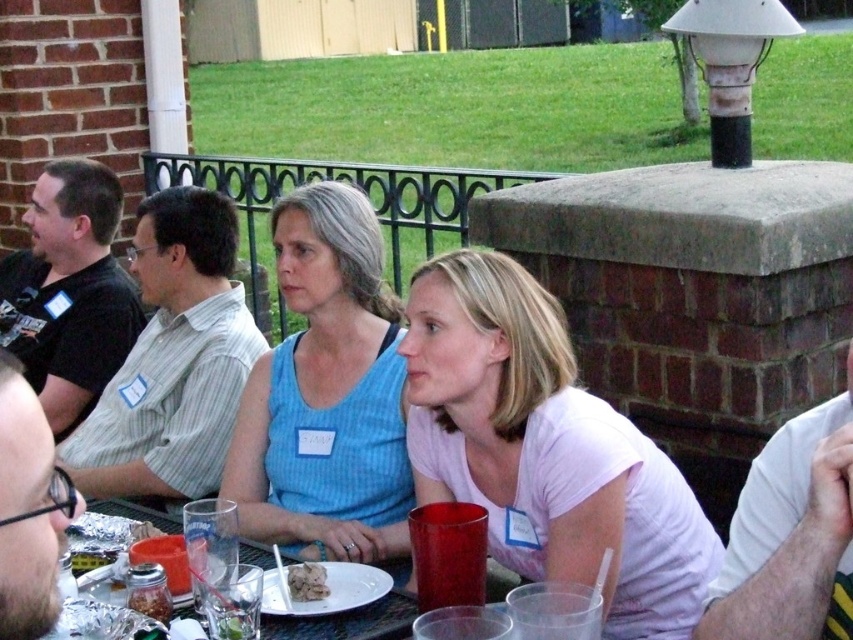
Measure the distance between pink matte shirt at center and blue striped tank top at center.

19.93 inches

Which is more to the left, pink matte shirt at center or blue striped tank top at center?

From the viewer's perspective, blue striped tank top at center appears more on the left side.

Where is `pink matte shirt at center`? pink matte shirt at center is located at coordinates (544, 449).

Locate an element on the screen. This screenshot has width=853, height=640. pink matte shirt at center is located at coordinates (544, 449).

Which is more to the left, pink matte shirt at center or clear plastic plate at lower center?

Positioned to the left is clear plastic plate at lower center.

Is pink matte shirt at center positioned in front of clear plastic plate at lower center?

Yes.

This screenshot has height=640, width=853. I want to click on pink matte shirt at center, so click(x=544, y=449).

Is blue striped tank top at center to the left of clear plastic plate at lower center from the viewer's perspective?

No, blue striped tank top at center is not to the left of clear plastic plate at lower center.

Between blue striped tank top at center and clear plastic plate at lower center, which one has less height?

With less height is clear plastic plate at lower center.

You are a GUI agent. You are given a task and a screenshot of the screen. Output one action in this format:
    pyautogui.click(x=<x>, y=<y>)
    Task: Click on the blue striped tank top at center
    The image size is (853, 640).
    Given the screenshot: What is the action you would take?
    pyautogui.click(x=326, y=392)